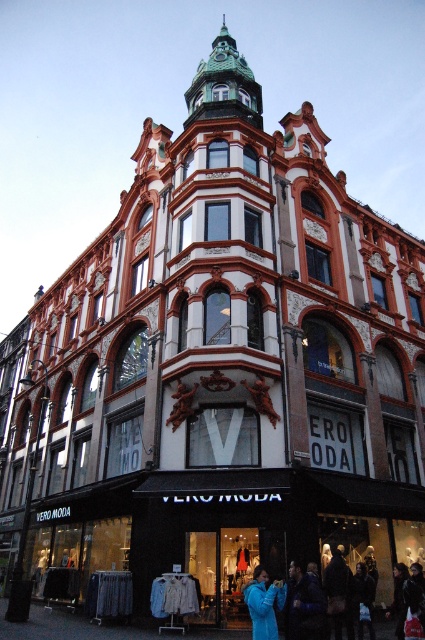
You are a tailor who needs to determine which jacket to alter first based on their widths. Given that you have the dark blue jacket at lower center and the blue fleece jacket at lower center in front of you, which jacket requires more fabric to adjust its width?

The blue fleece jacket at lower center requires more fabric to adjust its width since it is wider than the dark blue jacket at lower center.

You are standing in front of the corner building with the green domed tower. You see a dark blue jacket at lower center. Where exactly is the dark blue jacket located in the building?

The dark blue jacket at lower center is located at point [303,605] in the building.